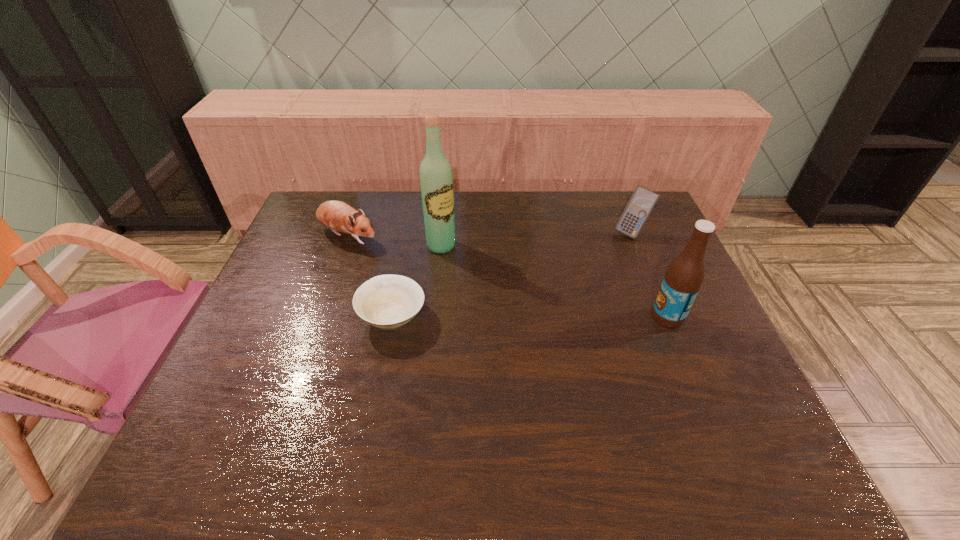
The image size is (960, 540). I want to click on free space that satisfies the following two spatial constraints: 1. on the front side of the beer bottle; 2. on the right side of the hamster, so click(x=319, y=316).

In order to click on free location that satisfies the following two spatial constraints: 1. on the front side of the second shortest object; 2. on the right side of the tallest object in this screenshot , I will do `click(344, 246)`.

This screenshot has width=960, height=540. Identify the location of vacant position in the image that satisfies the following two spatial constraints: 1. on the back side of the calculator; 2. on the left side of the shortest object. (409, 232).